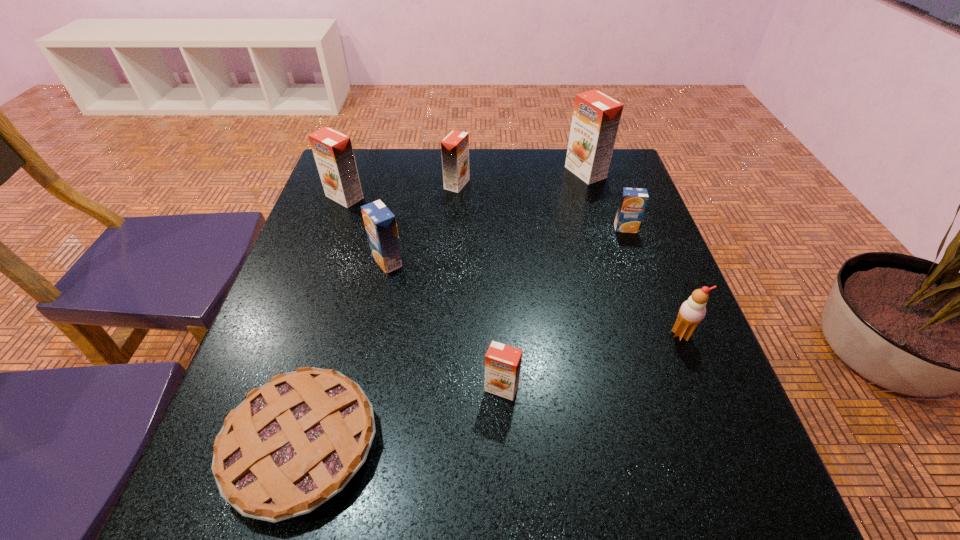
Image resolution: width=960 pixels, height=540 pixels. Find the location of `the smaller blue orange_juice`. the smaller blue orange_juice is located at coordinates (633, 201).

Locate an element on the screen. This screenshot has height=540, width=960. the fourth object from right to left is located at coordinates (502, 362).

Where is `the nearest orange juice`? The image size is (960, 540). the nearest orange juice is located at coordinates (502, 362).

Find the location of a particular element. Image resolution: width=960 pixels, height=540 pixels. the shortest object is located at coordinates (293, 443).

Find the location of a particular element. This screenshot has height=540, width=960. free region located 0.280m on the front of the tallest orange juice is located at coordinates tap(610, 253).

The image size is (960, 540). What are the coordinates of `free point located 0.090m on the back of the leftmost orange orange juice` in the screenshot? It's located at (355, 169).

I want to click on free region located 0.120m on the right of the fifth object from right to left, so click(513, 184).

The width and height of the screenshot is (960, 540). Identify the location of vacant space located on the front of the fourth nearest object. (372, 340).

This screenshot has width=960, height=540. Identify the location of vacant space located at the front with a straw on the third nearest object. (729, 456).

At what (x,y) coordinates should I click in order to perform the action: click on free space located on the back of the right blue orange_juice. Please return your answer as a coordinate pair (x, y). Looking at the image, I should click on (613, 195).